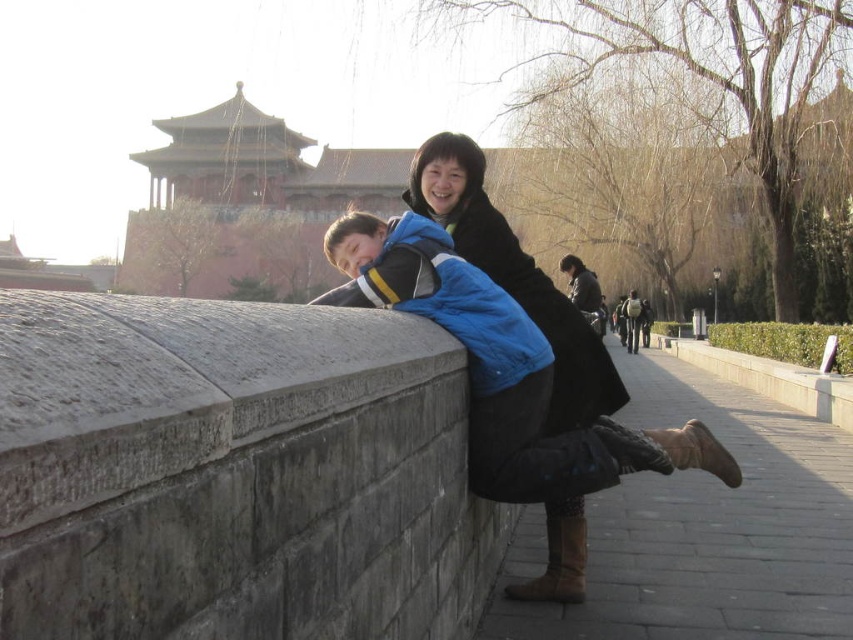
You are a fashion designer analyzing the image. You need to determine which item has a greater horizontal span when viewed from the front. Which one is wider between the matte blue jacket at center and the brown suede boot at lower center?

The matte blue jacket at center is wider than the brown suede boot at lower center because its width surpasses the boot.

You are a photographer trying to capture a photo of the matte blue jacket at center and the brown suede boot at lower center. Since you want both subjects to be in focus, which one should you focus on first to ensure the other is also sharp?

The matte blue jacket at center is located above the brown suede boot at lower center, so focusing on the matte blue jacket at center first would ensure the brown suede boot at lower center is also in focus since it is closer to the camera.